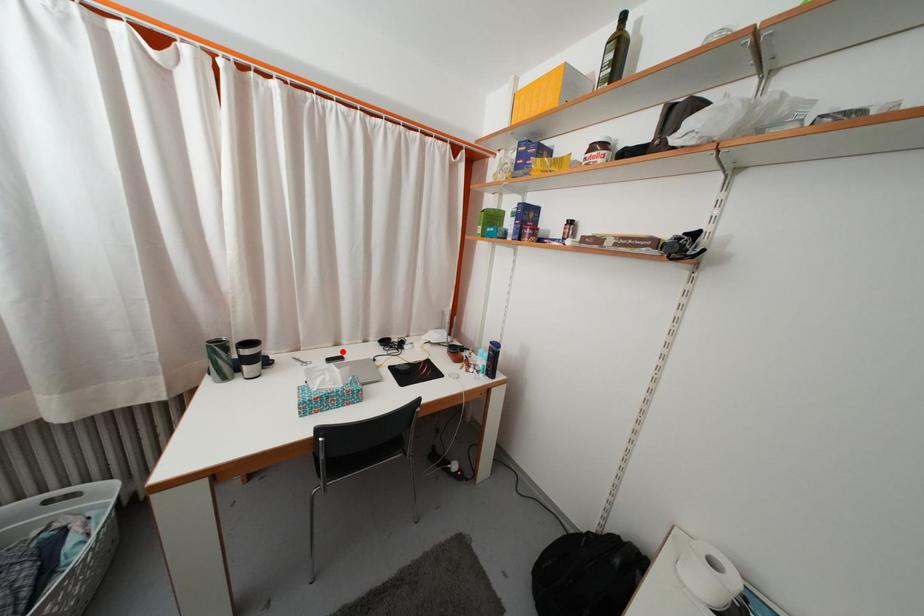
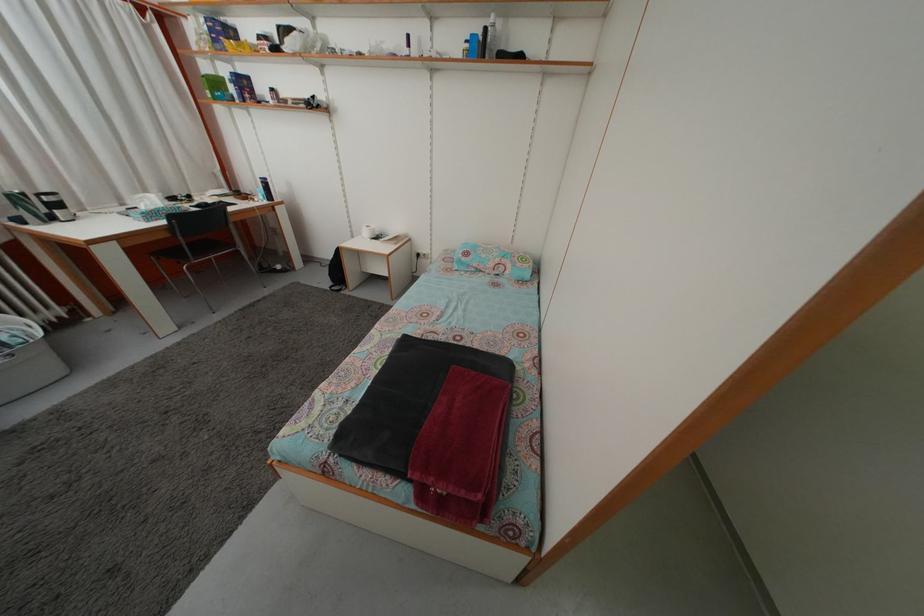
Where in the second image is the point corresponding to the highlighted location from the first image?

(128, 213)